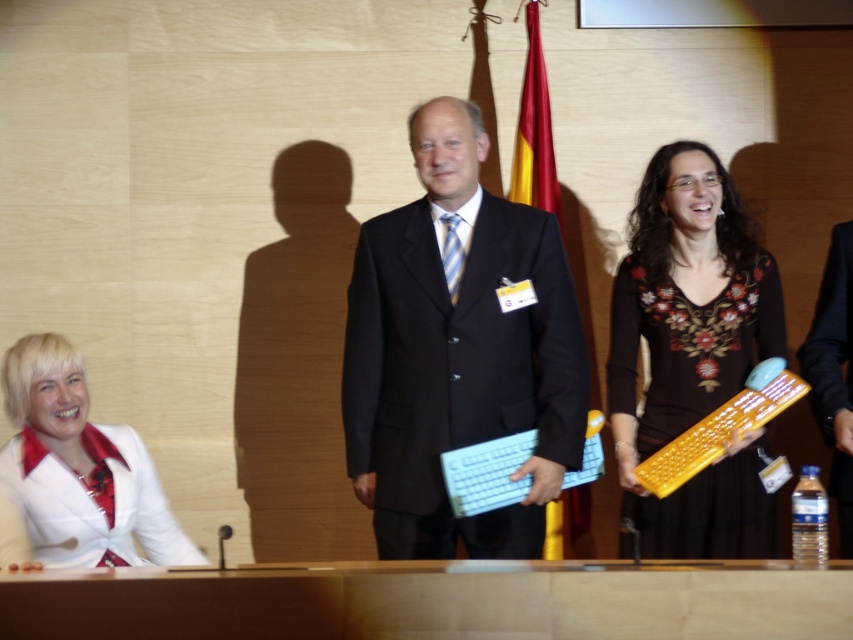
You are a photographer at a formal event and need to adjust the camera focus between the black matte suit at center and the white satin blouse at lower left. The minimum focus distance between two objects your camera can handle is 30 inches. Can you focus on both subjects simultaneously?

The distance between the black matte suit at center and the white satin blouse at lower left is 29.32 inches, which is less than the camera requirement of 30 inches. Therefore, the camera cannot focus on both subjects simultaneously.

You are attending a formal event and notice two people on stage. One is wearing a blue striped tie at center and the other has a brown floral dress at right. Based on their positions, which person is farther to the right side of the stage?

The brown floral dress at right is farther to the right side of the stage than the blue striped tie at center.

You are organizing a photo shoot and need to ensure that the black matte suit at center and the white satin blouse at lower left fit within a 1.2 meter wide frame. Based on their sizes, will both items fit side by side?

The black matte suit at center is wider than the white satin blouse at lower left. Since the combined width of both items would exceed 1.2 meters, they cannot fit side by side within the frame.